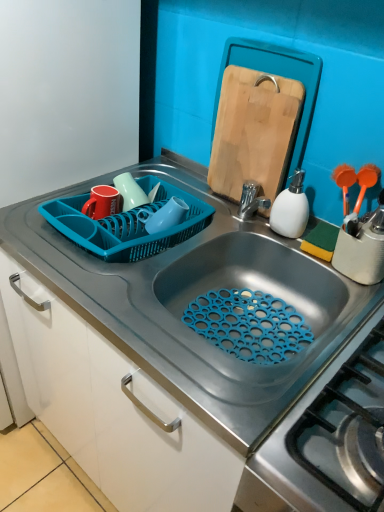
The height and width of the screenshot is (512, 384). Find the location of `vacant region in front of white matte soap dispenser at right`. vacant region in front of white matte soap dispenser at right is located at coordinates (312, 267).